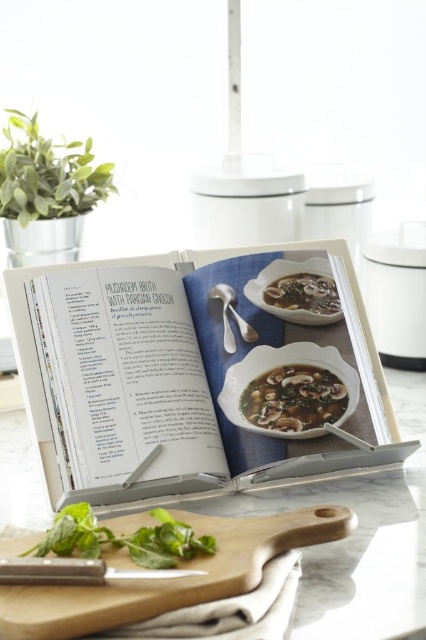
Question: Is wooden cutting board at lower center to the right of satin silver spoon at upper center from the viewer's perspective?

Choices:
 (A) yes
 (B) no

Answer: (B)

Question: Estimate the real-world distances between objects in this image. Which object is farther from the savory broth with mushrooms at center?

Choices:
 (A) savory brown broth with mushrooms at center
 (B) white glossy cookbook at center

Answer: (B)

Question: Can you confirm if green leafy herb at lower left is thinner than savory broth with mushrooms at center?

Choices:
 (A) yes
 (B) no

Answer: (B)

Question: Can you confirm if white glossy cookbook at center is smaller than green leafy herb at lower left?

Choices:
 (A) yes
 (B) no

Answer: (B)

Question: Which point appears farthest from the camera in this image?

Choices:
 (A) (322, 314)
 (B) (256, 416)
 (C) (86, 544)

Answer: (A)

Question: Which point is closer to the camera?

Choices:
 (A) (290, 369)
 (B) (213, 289)
 (C) (32, 547)
 (D) (258, 326)

Answer: (C)